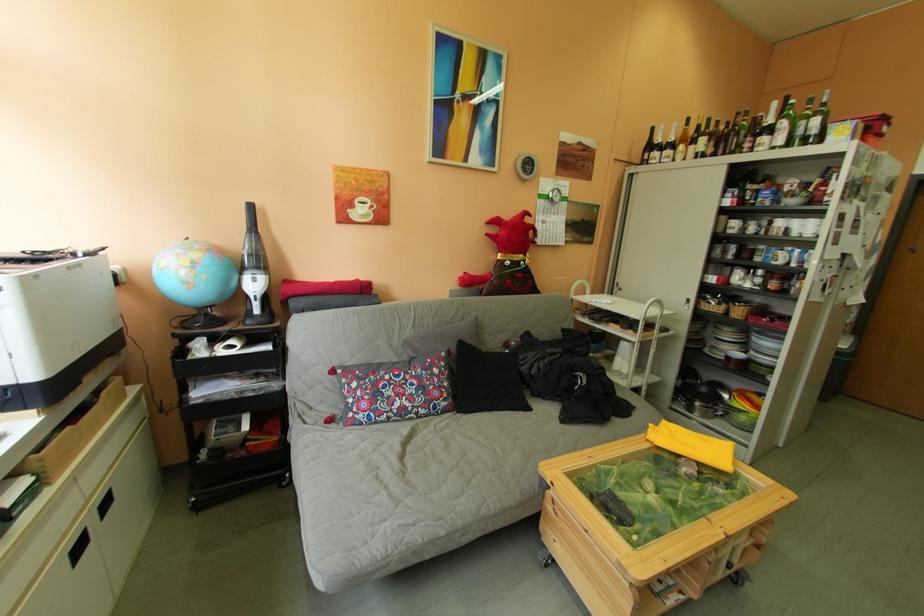
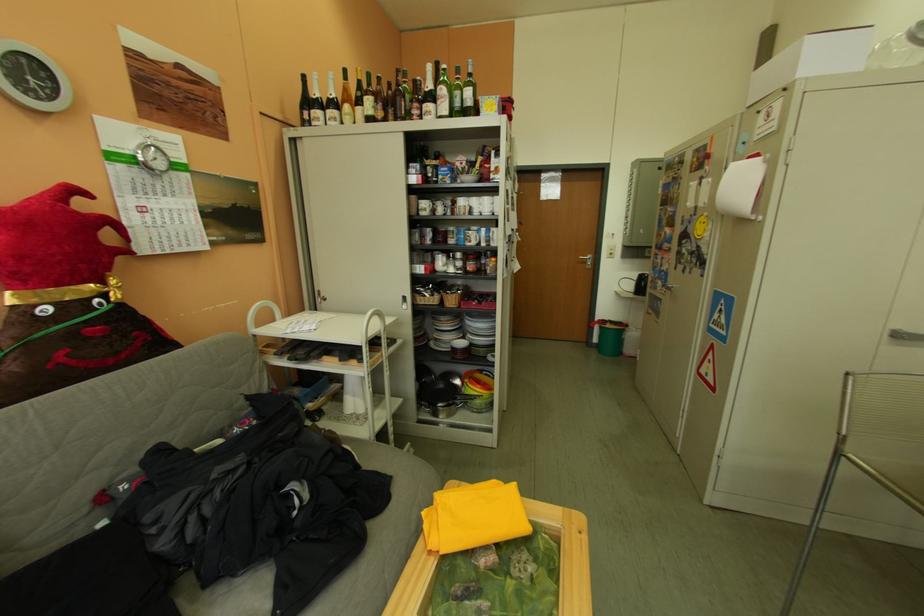
Locate, in the second image, the point that corresponds to [645,164] in the first image.

(302, 126)